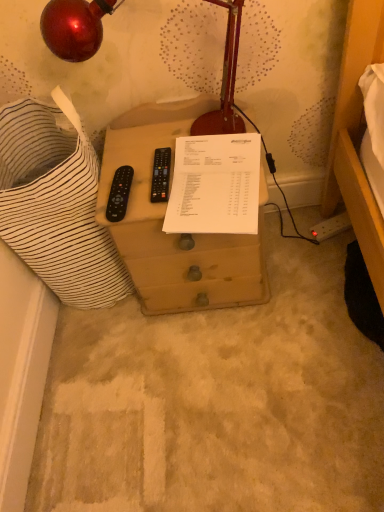
At what (x,y) coordinates should I click in order to perform the action: click on vacant space underneath metallic red lamp at upper left (from a real-world perspective). Please return your answer as a coordinate pair (x, y). This screenshot has width=384, height=512. Looking at the image, I should click on (148, 147).